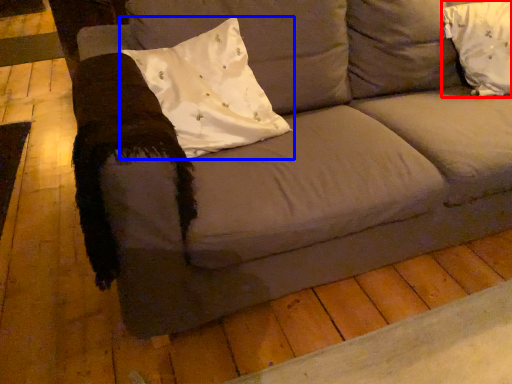
Question: Which of the following is the closest to the observer, pillow (highlighted by a red box) or pillow (highlighted by a blue box)?

Choices:
 (A) pillow
 (B) pillow

Answer: (B)